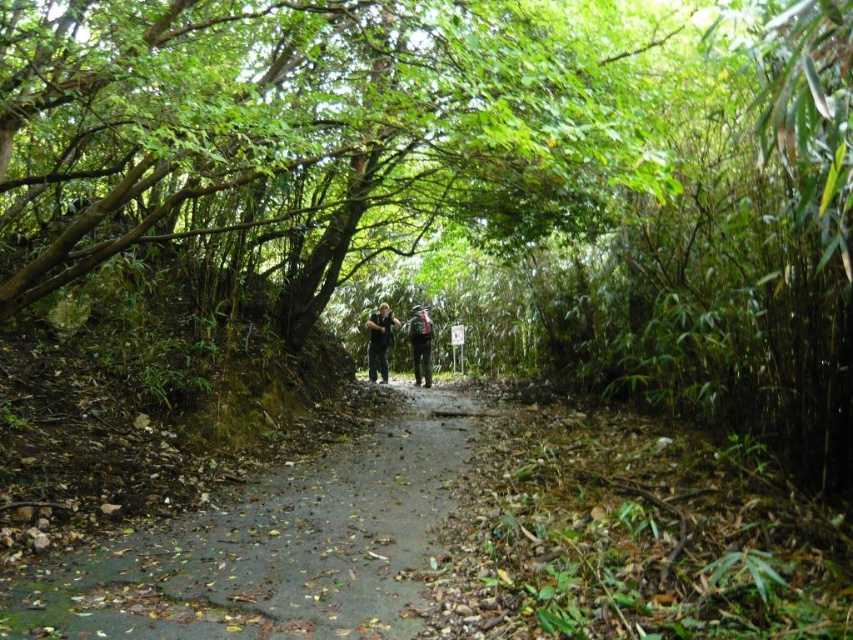
Who is taller, dull gray concrete path at center or dark gray jacket at center?

With more height is dark gray jacket at center.

At what (x,y) coordinates should I click in order to perform the action: click on dull gray concrete path at center. Please return your answer as a coordinate pair (x, y). This screenshot has height=640, width=853. Looking at the image, I should click on (276, 547).

Does green leafy tree at center appear over dull gray concrete path at center?

Indeed, green leafy tree at center is positioned over dull gray concrete path at center.

Which is behind, point (308, 218) or point (231, 572)?

Point (308, 218)

What do you see at coordinates (308, 125) in the screenshot? The image size is (853, 640). I see `green leafy tree at center` at bounding box center [308, 125].

The height and width of the screenshot is (640, 853). Identify the location of green leafy tree at center. (308, 125).

Does dark gray jacket at center have a smaller size compared to dark green fabric jacket at center?

Indeed, dark gray jacket at center has a smaller size compared to dark green fabric jacket at center.

Does dark gray jacket at center appear over dark green fabric jacket at center?

Indeed, dark gray jacket at center is positioned over dark green fabric jacket at center.

Between point (374, 330) and point (415, 307), which one is positioned behind?

Positioned behind is point (415, 307).

The width and height of the screenshot is (853, 640). I want to click on dark gray jacket at center, so click(379, 340).